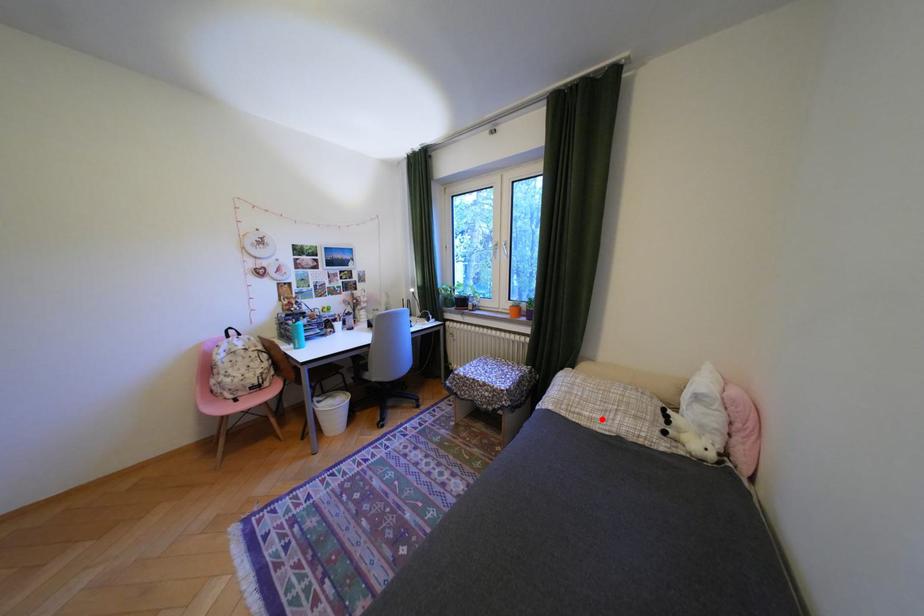
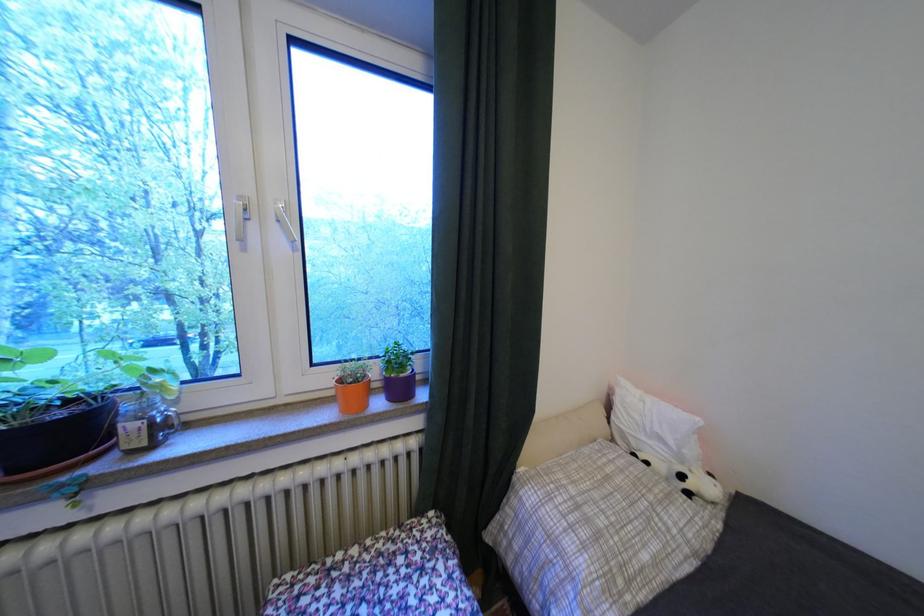
Locate, in the second image, the point that corresponds to the highlighted location in the first image.

(667, 562)